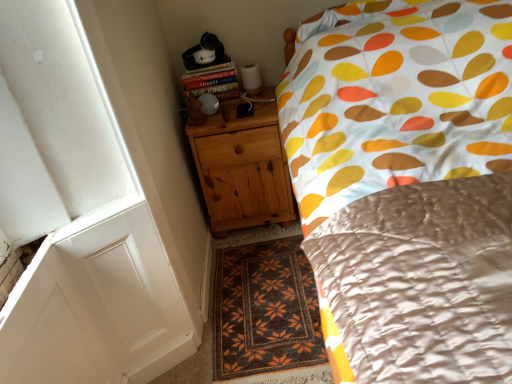
I want to click on free space above brown woven rug at center (from a real-world perspective), so click(x=248, y=301).